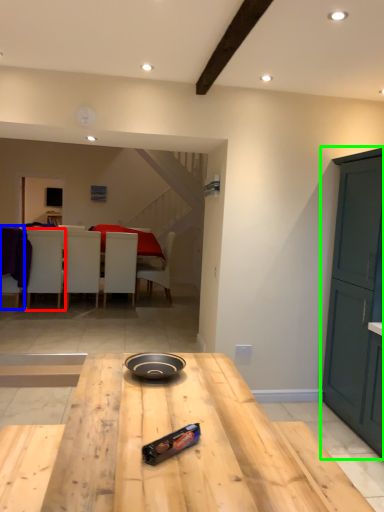
Question: Based on their relative distances, which object is nearer to chair (highlighted by a red box)? Choose from chair (highlighted by a blue box) and cabinetry (highlighted by a green box).

Choices:
 (A) chair
 (B) cabinetry

Answer: (A)